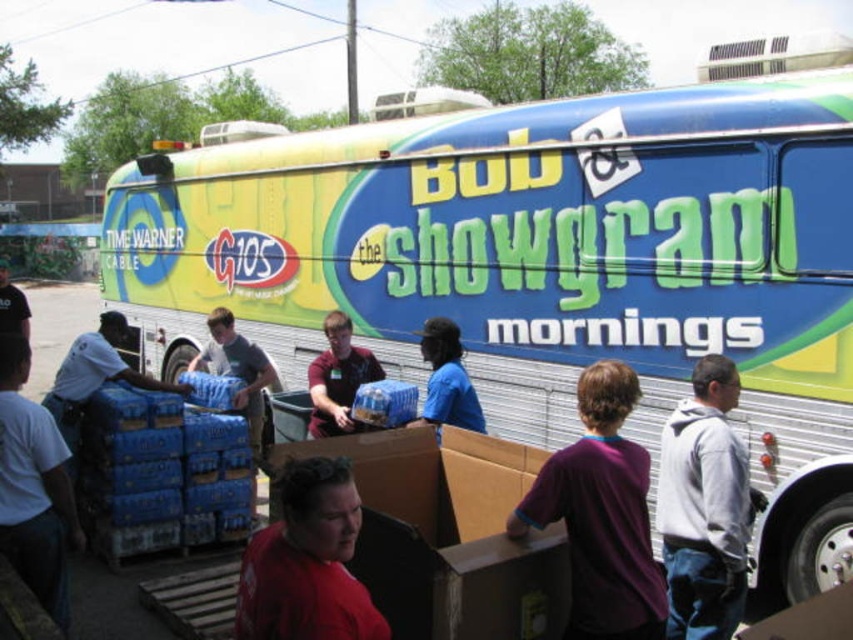
Question: Does white cotton shirt at center appear on the right side of light blue uniform at left?

Choices:
 (A) no
 (B) yes

Answer: (B)

Question: Does purple cotton shirt at center appear over white cotton shirt at center?

Choices:
 (A) yes
 (B) no

Answer: (A)

Question: Can you confirm if matte black shirt at center is positioned to the right of blue fabric shirt at center?

Choices:
 (A) no
 (B) yes

Answer: (B)

Question: Which point is farther from the camera taking this photo?

Choices:
 (A) (0, 330)
 (B) (457, 374)
 (C) (378, 548)
 (D) (141, 372)

Answer: (A)

Question: Among these points, which one is nearest to the camera?

Choices:
 (A) (344, 636)
 (B) (25, 301)
 (C) (548, 516)
 (D) (527, 602)

Answer: (A)

Question: Which point is closer to the camera taking this photo?

Choices:
 (A) (677, 588)
 (B) (346, 419)

Answer: (A)